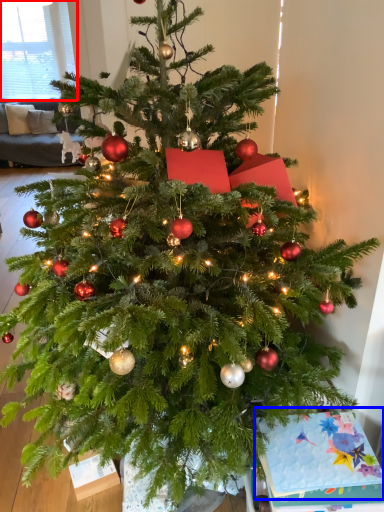
Question: Which object is further to the camera taking this photo, window screen (highlighted by a red box) or christmas card (highlighted by a blue box)?

Choices:
 (A) window screen
 (B) christmas card

Answer: (A)